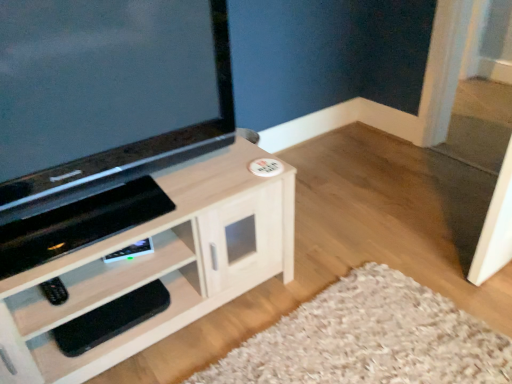
Question: Does matte black tv at upper left have a smaller size compared to black matte remote at lower left?

Choices:
 (A) no
 (B) yes

Answer: (A)

Question: Is matte black tv at upper left further to the viewer compared to black matte remote at lower left?

Choices:
 (A) yes
 (B) no

Answer: (B)

Question: Is matte black tv at upper left far away from black matte remote at lower left?

Choices:
 (A) yes
 (B) no

Answer: (B)

Question: From a real-world perspective, is matte black tv at upper left on black matte remote at lower left?

Choices:
 (A) yes
 (B) no

Answer: (A)

Question: Is matte black tv at upper left to the right of black matte remote at lower left from the viewer's perspective?

Choices:
 (A) yes
 (B) no

Answer: (A)

Question: Is matte black tv at upper left shorter than black matte remote at lower left?

Choices:
 (A) yes
 (B) no

Answer: (B)

Question: From the image's perspective, would you say black rubber footrest at lower left is positioned over matte black tv at upper left?

Choices:
 (A) yes
 (B) no

Answer: (B)

Question: Is black rubber footrest at lower left taller than matte black tv at upper left?

Choices:
 (A) no
 (B) yes

Answer: (A)

Question: Are black rubber footrest at lower left and matte black tv at upper left far apart?

Choices:
 (A) no
 (B) yes

Answer: (A)

Question: Does black rubber footrest at lower left touch matte black tv at upper left?

Choices:
 (A) no
 (B) yes

Answer: (A)

Question: Could you tell me if black rubber footrest at lower left is facing matte black tv at upper left?

Choices:
 (A) yes
 (B) no

Answer: (B)

Question: Is black rubber footrest at lower left shorter than matte black tv at upper left?

Choices:
 (A) yes
 (B) no

Answer: (A)

Question: Is the surface of black rubber footrest at lower left in direct contact with light wood cabinet at center?

Choices:
 (A) yes
 (B) no

Answer: (B)